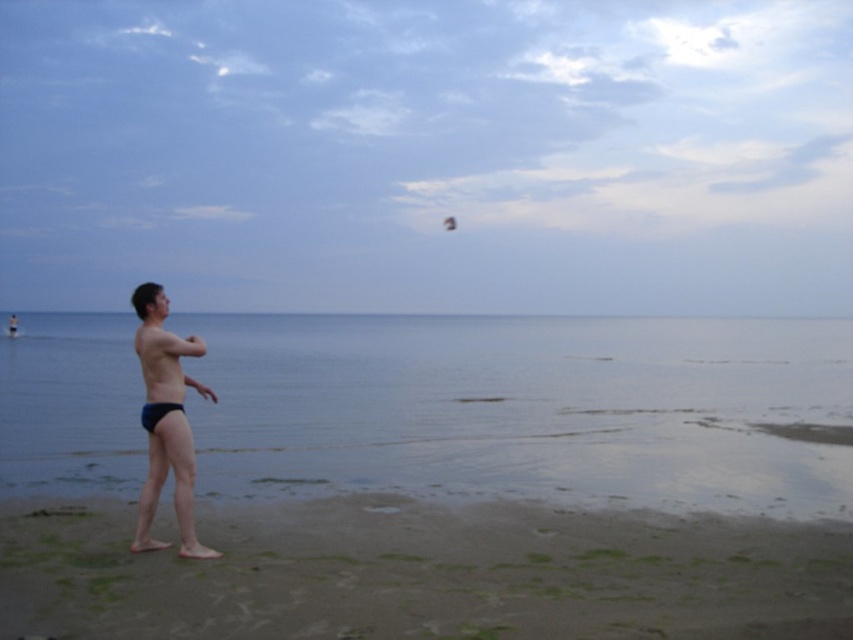
You are standing on the beach and see the brown sandy beach at lower center and the dark blue swim trunks at left. Which object is positioned to the right of the other?

The brown sandy beach at lower center is positioned to the right of the dark blue swim trunks at left.